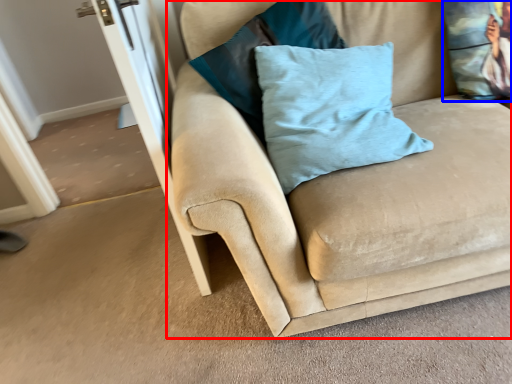
Question: Which object appears farthest to the camera in this image, studio couch (highlighted by a red box) or pillow (highlighted by a blue box)?

Choices:
 (A) studio couch
 (B) pillow

Answer: (B)